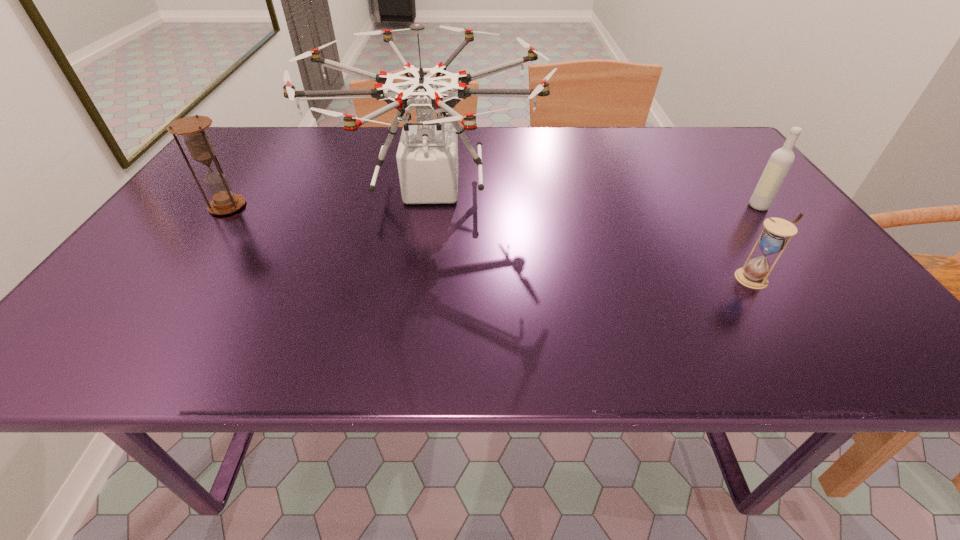
In order to click on the second object from left to right in this screenshot , I will do `click(427, 157)`.

This screenshot has width=960, height=540. What are the coordinates of `drone` in the screenshot? It's located at (427, 157).

At what (x,y) coordinates should I click in order to perform the action: click on the taller hourglass. Please return your answer as a coordinate pair (x, y). Looking at the image, I should click on (192, 128).

Locate an element on the screen. The height and width of the screenshot is (540, 960). the leftmost object is located at coordinates (192, 128).

Locate an element on the screen. The width and height of the screenshot is (960, 540). the rightmost object is located at coordinates [x=781, y=160].

Where is `the nearest object`? This screenshot has width=960, height=540. the nearest object is located at coordinates (774, 238).

This screenshot has width=960, height=540. I want to click on the shorter hourglass, so point(774,238).

Image resolution: width=960 pixels, height=540 pixels. I want to click on vacant space positioned 0.320m on the left of the drone, so click(194, 188).

Find the location of a particular element. This screenshot has width=960, height=540. vacant space located 0.310m on the front of the farther hourglass is located at coordinates (149, 317).

The image size is (960, 540). Find the location of `vacant space located 0.050m on the left of the rightmost object`. vacant space located 0.050m on the left of the rightmost object is located at coordinates (729, 206).